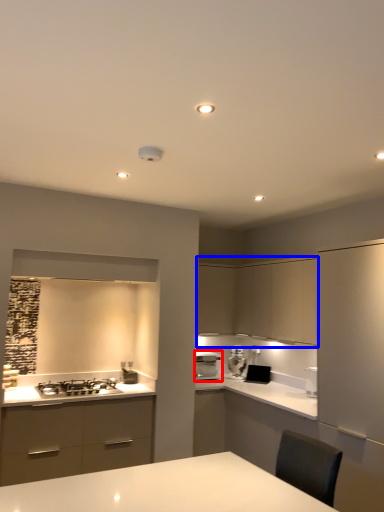
Question: Among these objects, which one is farthest to the camera, home appliance (highlighted by a red box) or cabinetry (highlighted by a blue box)?

Choices:
 (A) home appliance
 (B) cabinetry

Answer: (A)